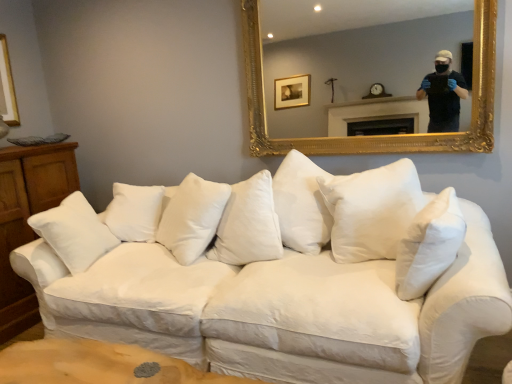
What do you see at coordinates (192, 217) in the screenshot? The width and height of the screenshot is (512, 384). I see `white cotton pillow at center, acting as the second pillow starting from the front` at bounding box center [192, 217].

Measure the distance between white soft pillow at center, which is the first pillow from front to back, and camera.

5.19 feet.

The height and width of the screenshot is (384, 512). Describe the element at coordinates (429, 245) in the screenshot. I see `white soft pillow at center, positioned as the 2th pillow in left-to-right order` at that location.

This screenshot has height=384, width=512. What do you see at coordinates (354, 51) in the screenshot?
I see `gold ornate mirror at upper center` at bounding box center [354, 51].

What do you see at coordinates (26, 219) in the screenshot? This screenshot has width=512, height=384. I see `wooden dresser at left` at bounding box center [26, 219].

Locate an element on the screen. This screenshot has width=512, height=384. white cotton pillow at center, which is the 1th pillow from left to right is located at coordinates (192, 217).

From the image's perspective, is wooden dresser at left positioned above or below white cotton pillow at center, which is the 1th pillow from left to right?

Based on their image positions, wooden dresser at left is located beneath white cotton pillow at center, which is the 1th pillow from left to right.

Between wooden dresser at left and white cotton pillow at center, acting as the second pillow starting from the front, which one has larger width?

Wider between the two is wooden dresser at left.

Is there a large distance between wooden dresser at left and white cotton pillow at center, the 2th pillow viewed from the right?

Yes, wooden dresser at left and white cotton pillow at center, the 2th pillow viewed from the right, are quite far apart.

Considering the relative sizes of wooden dresser at left and white cotton pillow at center, acting as the second pillow starting from the front, in the image provided, is wooden dresser at left bigger than white cotton pillow at center, acting as the second pillow starting from the front,?

Yes, wooden dresser at left is bigger than white cotton pillow at center, acting as the second pillow starting from the front.

Is white cotton pillow at center, which is the 1th pillow from left to right, touching white cotton couch at center?

No, white cotton pillow at center, which is the 1th pillow from left to right, is not next to white cotton couch at center.

Is white cotton pillow at center, the 1th pillow positioned from the back, turned away from white cotton couch at center?

That's right, white cotton pillow at center, the 1th pillow positioned from the back, is facing away from white cotton couch at center.

Is point (172, 229) closer or farther from the camera than point (366, 321)?

Point (172, 229).

From the image's perspective, would you say white cotton pillow at center, the 1th pillow positioned from the back, is positioned over white cotton couch at center?

Yes.

From the picture: Which is farther from the camera, (416, 84) or (200, 305)?

Positioned behind is point (416, 84).

Is gold ornate mirror at upper center closer to camera compared to white cotton couch at center?

No, gold ornate mirror at upper center is further to the viewer.

From a real-world perspective, is gold ornate mirror at upper center physically below white cotton couch at center?

No.

Considering the positions of point (393, 54) and point (445, 228), is point (393, 54) closer or farther from the camera than point (445, 228)?

Point (393, 54) appears to be farther away from the viewer than point (445, 228).

Is gold ornate mirror at upper center not within white soft pillow at center, positioned as the 2th pillow in left-to-right order?

Yes, gold ornate mirror at upper center is outside of white soft pillow at center, positioned as the 2th pillow in left-to-right order.

Who is bigger, gold ornate mirror at upper center or white soft pillow at center, positioned as the 2th pillow in left-to-right order?

gold ornate mirror at upper center.

Does gold ornate mirror at upper center turn towards white soft pillow at center, which is the first pillow from front to back?

No, gold ornate mirror at upper center is not aimed at white soft pillow at center, which is the first pillow from front to back.

Considering the sizes of white soft pillow at center, positioned as the 2th pillow in left-to-right order, and white cotton pillow at center, the 1th pillow positioned from the back, in the image, is white soft pillow at center, positioned as the 2th pillow in left-to-right order, taller or shorter than white cotton pillow at center, the 1th pillow positioned from the back,?

white soft pillow at center, positioned as the 2th pillow in left-to-right order, is shorter than white cotton pillow at center, the 1th pillow positioned from the back.

Is white soft pillow at center, which is the first pillow from front to back, touching white cotton pillow at center, the 2th pillow viewed from the right?

No, white soft pillow at center, which is the first pillow from front to back, is not beside white cotton pillow at center, the 2th pillow viewed from the right.

Does white soft pillow at center, which is the first pillow from front to back, turn towards white cotton pillow at center, the 1th pillow positioned from the back?

Yes, white soft pillow at center, which is the first pillow from front to back, faces towards white cotton pillow at center, the 1th pillow positioned from the back.

From a real-world perspective, does white soft pillow at center, the 2th pillow positioned from the back, stand above white cotton pillow at center, acting as the second pillow starting from the front?

Actually, white soft pillow at center, the 2th pillow positioned from the back, is physically below white cotton pillow at center, acting as the second pillow starting from the front, in the real world.

Between gold ornate mirror at upper center and white cotton pillow at center, which is the 1th pillow from left to right, which one is positioned in front?

gold ornate mirror at upper center.

Find the location of a particular element. The height and width of the screenshot is (384, 512). the 1st pillow below when counting from the gold ornate mirror at upper center (from the image's perspective) is located at coordinates (192, 217).

Could white cotton pillow at center, acting as the second pillow starting from the front, be considered to be inside gold ornate mirror at upper center?

No, white cotton pillow at center, acting as the second pillow starting from the front, is located outside of gold ornate mirror at upper center.

Considering the relative positions of white cotton pillow at center, acting as the second pillow starting from the front, and gold ornate mirror at upper center in the image provided, is white cotton pillow at center, acting as the second pillow starting from the front, to the left or to the right of gold ornate mirror at upper center?

white cotton pillow at center, acting as the second pillow starting from the front, is to the left of gold ornate mirror at upper center.

Is white cotton pillow at center, the 2th pillow viewed from the right, not near gold ornate mirror at upper center?

Indeed, white cotton pillow at center, the 2th pillow viewed from the right, is not near gold ornate mirror at upper center.

From a real-world perspective, is white cotton pillow at center, acting as the second pillow starting from the front, under gold ornate mirror at upper center?

Correct, in the physical world, white cotton pillow at center, acting as the second pillow starting from the front, is lower than gold ornate mirror at upper center.

From the image's perspective, starting from the wooden dresser at left, which pillow is the 2nd one above? Please provide its 2D coordinates.

[(192, 217)]

In the image, there is a white cotton pillow at center, which is the 1th pillow from left to right. Identify the location of studio couch below it (from a real-world perspective). (271, 280).

When comparing their distances from wooden dresser at left, does gold ornate mirror at upper center or white cotton pillow at center, acting as the second pillow starting from the front, seem further?

gold ornate mirror at upper center is further to wooden dresser at left.

Which object lies nearer to the anchor point wooden dresser at left, white cotton pillow at center, which is the 1th pillow from left to right, or gold ornate mirror at upper center?

The object closer to wooden dresser at left is white cotton pillow at center, which is the 1th pillow from left to right.

When comparing their distances from white cotton couch at center, does white soft pillow at center, which appears as the first pillow when viewed from the right, or gold ornate mirror at upper center seem further?

The object further to white cotton couch at center is gold ornate mirror at upper center.

When comparing their distances from white cotton couch at center, does gold ornate mirror at upper center or white cotton pillow at center, the 2th pillow viewed from the right, seem closer?

Among the two, white cotton pillow at center, the 2th pillow viewed from the right, is located nearer to white cotton couch at center.

Looking at the image, which one is located further to gold ornate mirror at upper center, white cotton couch at center or wooden dresser at left?

Among the two, wooden dresser at left is located further to gold ornate mirror at upper center.

From the image, which object appears to be nearer to gold ornate mirror at upper center, white cotton couch at center or white cotton pillow at center, the 1th pillow positioned from the back?

The object closer to gold ornate mirror at upper center is white cotton couch at center.

Looking at the image, which one is located further to white cotton couch at center, gold ornate mirror at upper center or white soft pillow at center, which is the first pillow from front to back?

gold ornate mirror at upper center is positioned further to the anchor white cotton couch at center.

Based on their spatial positions, is white cotton couch at center or white soft pillow at center, which appears as the first pillow when viewed from the right, further from white cotton pillow at center, the 1th pillow positioned from the back?

white soft pillow at center, which appears as the first pillow when viewed from the right, is further to white cotton pillow at center, the 1th pillow positioned from the back.

Image resolution: width=512 pixels, height=384 pixels. Find the location of `pillow between wooden dresser at left and white cotton couch at center`. pillow between wooden dresser at left and white cotton couch at center is located at coordinates (192, 217).

I want to click on studio couch between wooden dresser at left and white soft pillow at center, the 2th pillow positioned from the back, so click(271, 280).

This screenshot has height=384, width=512. I want to click on mirror between wooden dresser at left and white soft pillow at center, which is the first pillow from front to back, so click(x=354, y=51).

I want to click on pillow between wooden dresser at left and white soft pillow at center, which is the first pillow from front to back, in the horizontal direction, so click(x=192, y=217).